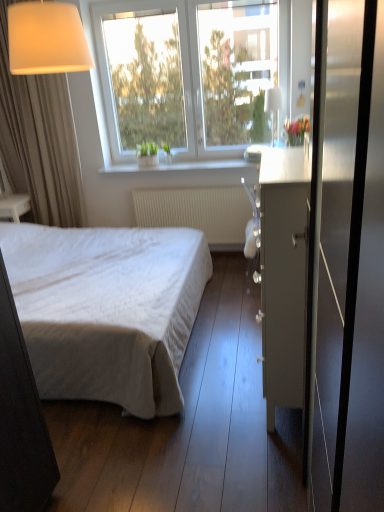
Locate an element on the screen. empty space that is ontop of white textured radiator at center is located at coordinates (192, 184).